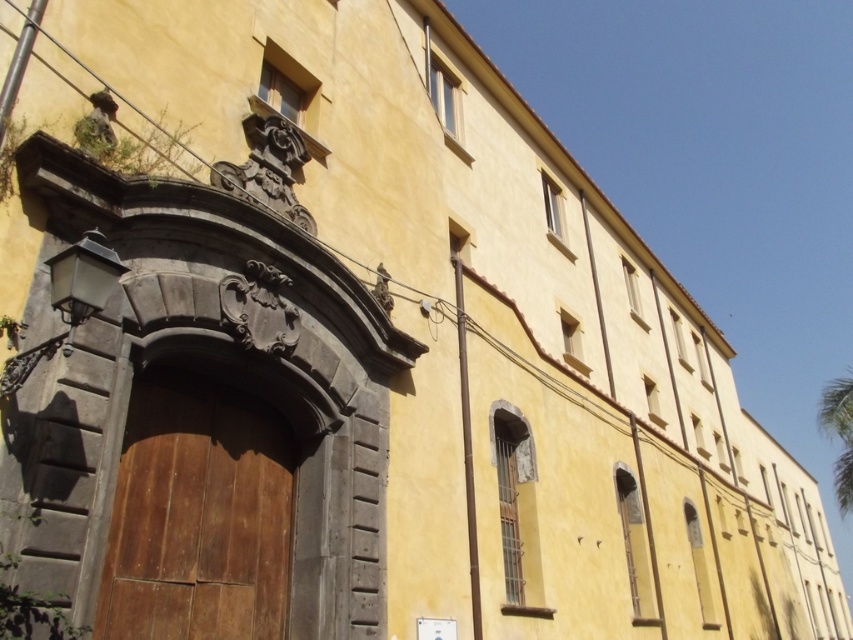
Can you confirm if wooden door at center is bigger than green leafy palm tree at upper right?

No, wooden door at center is not bigger than green leafy palm tree at upper right.

Does wooden door at center appear over green leafy palm tree at upper right?

Correct, wooden door at center is located above green leafy palm tree at upper right.

Describe the element at coordinates (198, 515) in the screenshot. The height and width of the screenshot is (640, 853). I see `wooden door at center` at that location.

Where is `wooden door at center`? The image size is (853, 640). wooden door at center is located at coordinates (198, 515).